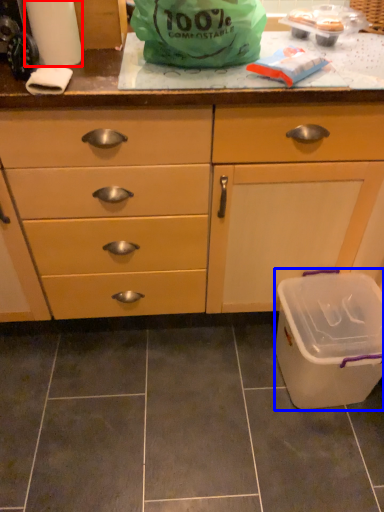
Question: Among these objects, which one is nearest to the camera, paper towel (highlighted by a red box) or recycling bin (highlighted by a blue box)?

Choices:
 (A) paper towel
 (B) recycling bin

Answer: (A)